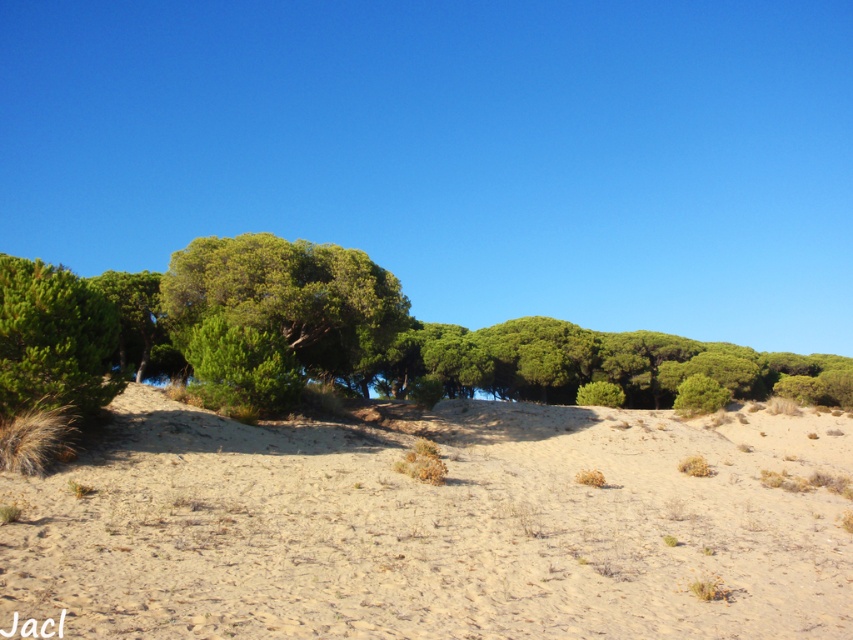
Is light brown sandy at center smaller than green leafy trees at center?

Correct, light brown sandy at center occupies less space than green leafy trees at center.

This screenshot has width=853, height=640. Describe the element at coordinates (432, 528) in the screenshot. I see `light brown sandy at center` at that location.

Locate an element on the screen. The image size is (853, 640). light brown sandy at center is located at coordinates (432, 528).

Can you confirm if green leafy trees at center is shorter than green leafy tree at upper left?

No.

Is green leafy trees at center to the left of green leafy tree at upper left from the viewer's perspective?

In fact, green leafy trees at center is to the right of green leafy tree at upper left.

Is point (509, 339) in front of point (94, 404)?

No, it is behind (94, 404).

Locate an element on the screen. This screenshot has width=853, height=640. green leafy trees at center is located at coordinates (602, 364).

Which is above, light brown sandy at center or green leafy tree at upper left?

Positioned higher is green leafy tree at upper left.

Does light brown sandy at center lie in front of green leafy tree at upper left?

Yes, light brown sandy at center is closer to the viewer.

Is point (309, 547) positioned behind point (102, 403)?

No.

I want to click on light brown sandy at center, so click(x=432, y=528).